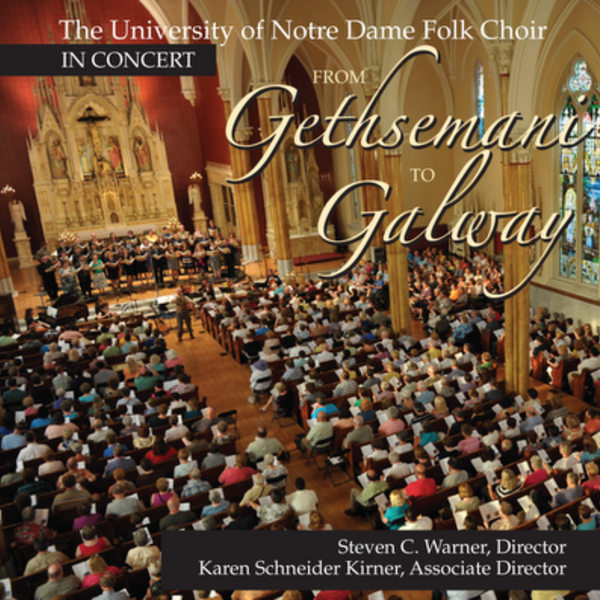
Image resolution: width=600 pixels, height=600 pixels. I want to click on stained glass window, so click(566, 193), click(591, 199).